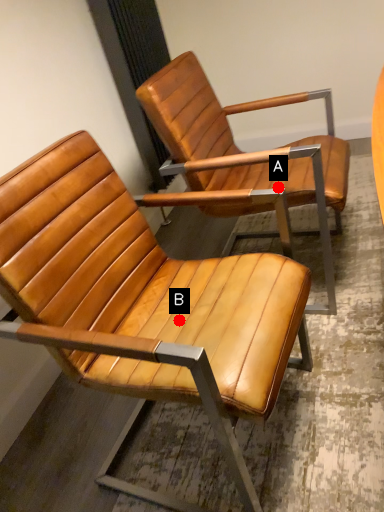
Question: Two points are circled on the image, labeled by A and B beside each circle. Which point is further to the camera?

Choices:
 (A) A is further
 (B) B is further

Answer: (A)